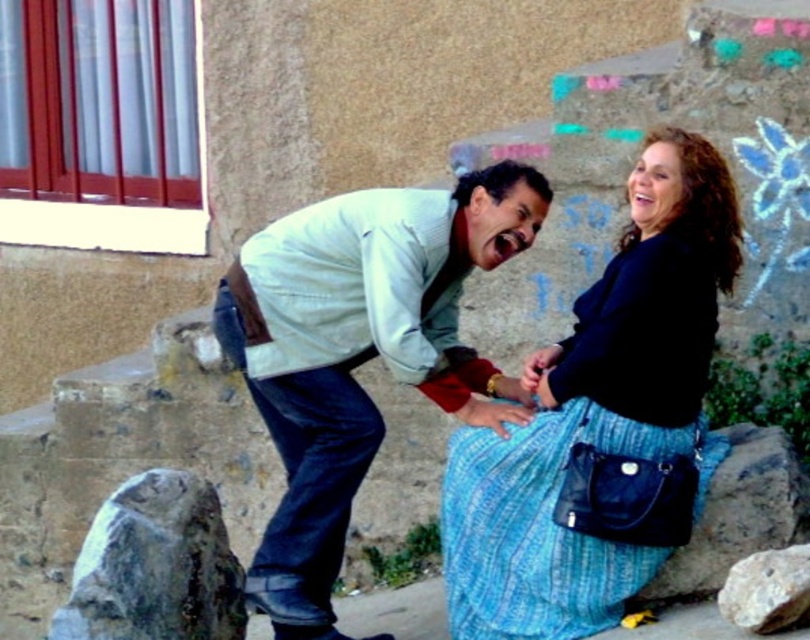
Does gray rough rock at lower left have a greater width compared to gray rough rock at lower right?

Yes.

Is point (145, 556) closer to camera compared to point (740, 561)?

No, it is not.

Who is more forward, (75,589) or (806,545)?

Point (806,545) is in front.

What are the coordinates of `gray rough rock at lower left` in the screenshot? It's located at (156, 566).

Is light blue denim jeans at center positioned at the back of gray rough rock at lower left?

That is True.

Between light blue denim jeans at center and gray rough rock at lower left, which one has more height?

With more height is light blue denim jeans at center.

Who is more distant from viewer, [393,317] or [114,576]?

Positioned behind is point [393,317].

This screenshot has height=640, width=810. What are the coordinates of `light blue denim jeans at center` in the screenshot? It's located at (x=360, y=352).

Is blue textured skirt at center taller than gray rough rock at lower right?

Correct, blue textured skirt at center is much taller as gray rough rock at lower right.

Does blue textured skirt at center have a lesser height compared to gray rough rock at lower right?

No.

Which is in front, point (559, 376) or point (791, 602)?

Positioned in front is point (791, 602).

This screenshot has width=810, height=640. Identify the location of blue textured skirt at center. (595, 410).